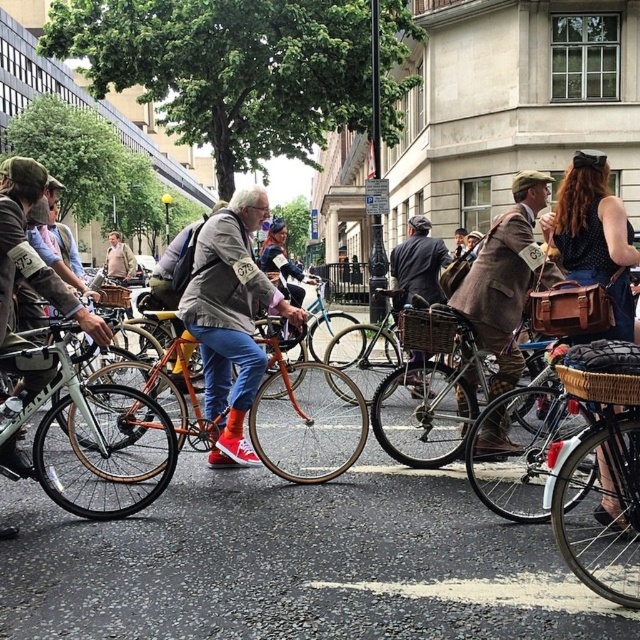
Question: Which point is closer to the camera?

Choices:
 (A) (492, 460)
 (B) (122, 248)
 (C) (260, 260)

Answer: (A)

Question: Which is farther from the shiny silver bicycle at center?

Choices:
 (A) matte beige jacket at center
 (B) brown leather jacket at center
 (C) wooden woven basket at center
 (D) brown leather bag at right

Answer: (B)

Question: Can you confirm if brown woolen suit at center is positioned above light brown leather jacket at center?

Choices:
 (A) yes
 (B) no

Answer: (B)

Question: Is denim jacket at left below brown woven basket at center?

Choices:
 (A) yes
 (B) no

Answer: (A)

Question: Which object is positioned farthest from the brown woven basket at lower right?

Choices:
 (A) light brown leather jacket at center
 (B) shiny silver bicycle at center
 (C) denim jacket at center
 (D) orange matte bicycle at center

Answer: (A)

Question: Can you confirm if light brown leather jacket at center is thinner than brown woven basket at center?

Choices:
 (A) yes
 (B) no

Answer: (B)